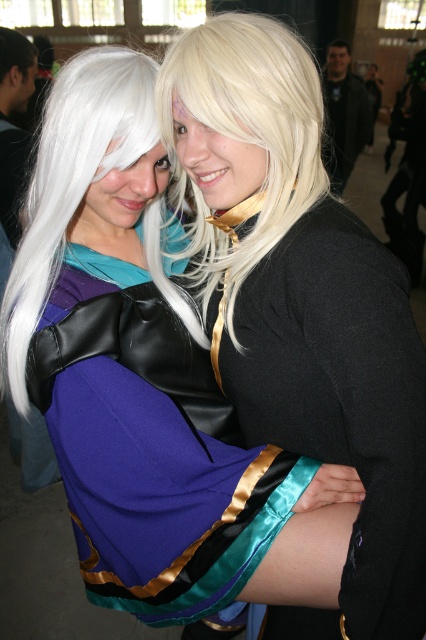
You are a photographer at a cosplay event and want to capture a closeup of the purple satin dress at center. Based on its position coordinates, where should you aim your camera?

The purple satin dress at center is located at coordinates point (164, 492), so aim your camera there to capture the closeup.

You are a photographer at a cosplay event and need to position the models so that the satin black dress at center and the white silky wig at left are both visible in the frame. Given their heights, which object should be placed closer to the camera to ensure both are fully visible?

The satin black dress at center is taller than the white silky wig at left, so placing the white silky wig at left closer to the camera will help ensure both are fully visible in the frame.